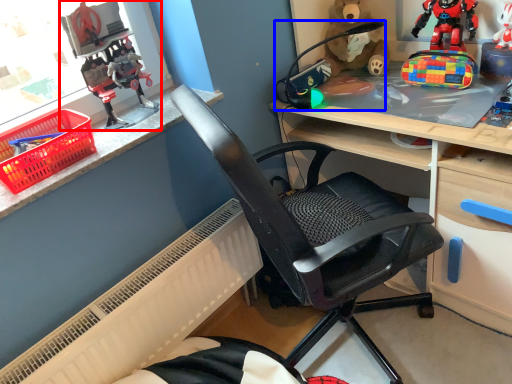
Question: Which object appears farthest to the camera in this image, toy (highlighted by a red box) or toy (highlighted by a blue box)?

Choices:
 (A) toy
 (B) toy

Answer: (B)